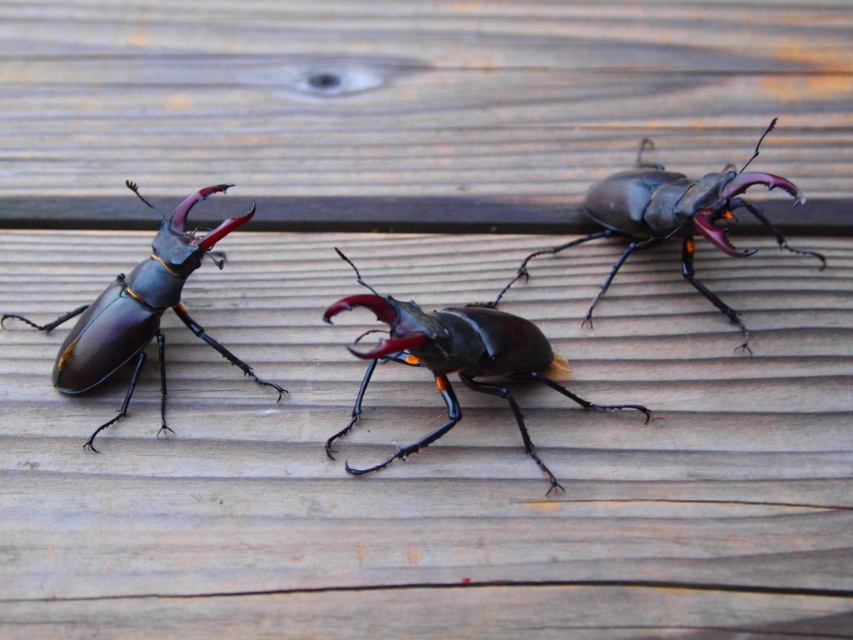
You are a child who wants to collect both the shiny dark brown beetle at center and the glossy black beetle at left in a jar. The jar has a diameter of 8 inches. Can you fit both beetles into the jar without overlapping them?

The shiny dark brown beetle at center and glossy black beetle at left are 9.59 inches apart from each other. Since the jar has a diameter of 8 inches, which is smaller than the distance between the beetles, you cannot fit both beetles into the jar without overlapping them.

You are a nature photographer observing the beetles on the wooden surface. You need to capture a photo where the shiny dark brown beetle at center is visible above the glossy black beetle at left. Is this possible given their current positions?

The shiny dark brown beetle at center is located below the glossy black beetle at left, so it would not be possible to capture a photo where the shiny dark brown beetle at center is visible above the glossy black beetle at left in their current positions.

Based on the photo, you are an entomologist examining a wooden surface with three stag beetles. You notice a point marked at coordinates (457, 358). Which beetle is located at this point?

The point at (457, 358) indicates the shiny dark brown beetle at center.